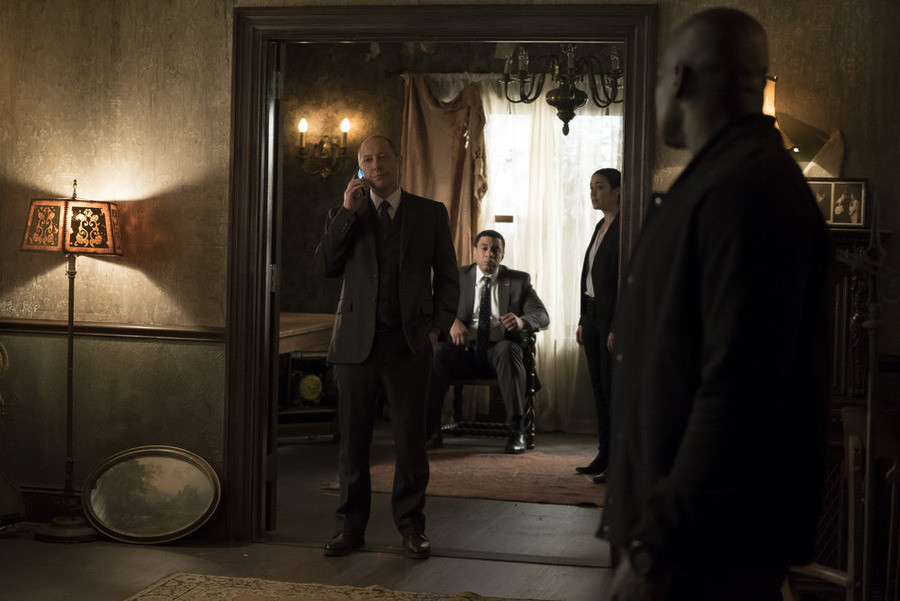
In order to click on curtain in this screenshot , I will do `click(461, 159)`.